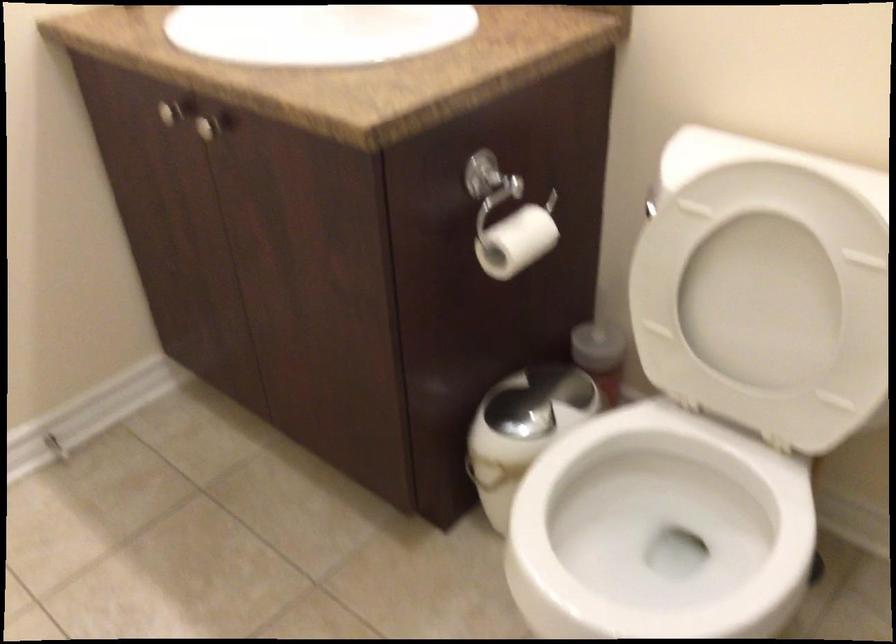
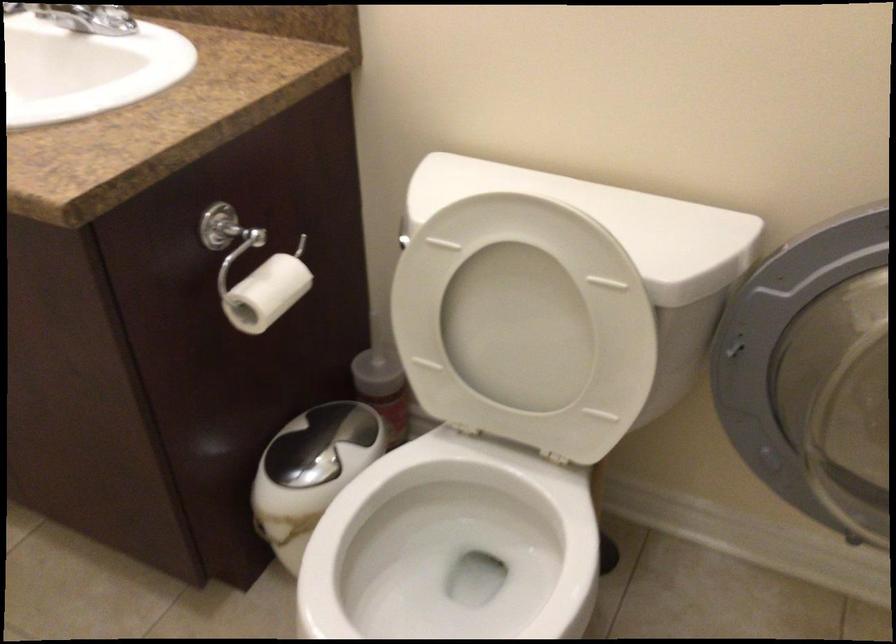
The point at (x=645, y=527) is marked in the first image. Where is the corresponding point in the second image?

(449, 564)